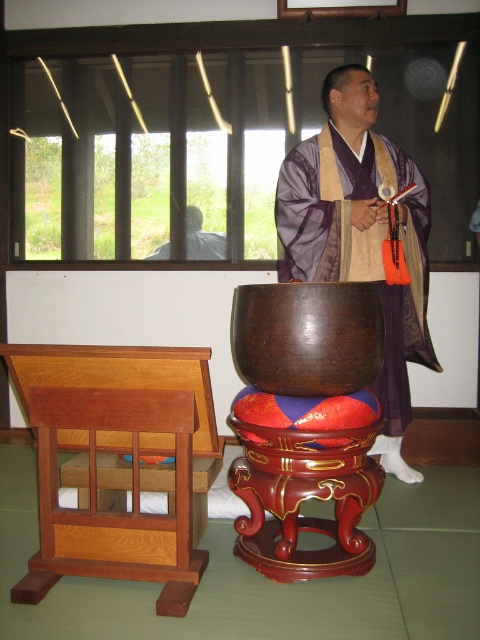
Question: Can you confirm if matte purple kimono at center is positioned above shiny lacquered stool at center?

Choices:
 (A) no
 (B) yes

Answer: (B)

Question: Does matte purple kimono at center appear on the right side of shiny lacquered stool at center?

Choices:
 (A) yes
 (B) no

Answer: (A)

Question: Which point is closer to the camera?

Choices:
 (A) (52, 435)
 (B) (263, 438)

Answer: (A)

Question: Which point is farther to the camera?

Choices:
 (A) (363, 246)
 (B) (49, 547)
 (C) (300, 568)

Answer: (A)

Question: Which of the following is the farthest from the observer?

Choices:
 (A) (83, 371)
 (B) (236, 426)
 (C) (339, 172)

Answer: (C)

Question: Can you confirm if wooden altar at center is smaller than matte purple kimono at center?

Choices:
 (A) no
 (B) yes

Answer: (B)